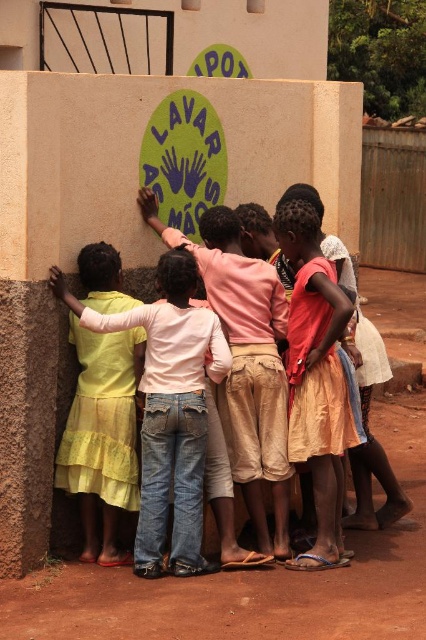
Is light yellow denim jeans at left to the left of light orange skirt at center from the viewer's perspective?

Indeed, light yellow denim jeans at left is positioned on the left side of light orange skirt at center.

Between point (204, 412) and point (285, 364), which one is positioned behind?

The point (285, 364) is more distant.

At what (x,y) coordinates should I click in order to perform the action: click on light yellow denim jeans at left. Please return your answer as a coordinate pair (x, y). The image size is (426, 640). Looking at the image, I should click on (169, 410).

Find the location of `light yellow denim jeans at left`. light yellow denim jeans at left is located at coordinates (169, 410).

Can you confirm if pink cotton shirt at center is taller than light orange skirt at center?

Correct, pink cotton shirt at center is much taller as light orange skirt at center.

Does point (282, 404) come behind point (290, 234)?

Yes, it is behind point (290, 234).

Find the location of a particular element. The height and width of the screenshot is (640, 426). pink cotton shirt at center is located at coordinates (244, 360).

Who is lower down, light yellow denim jeans at left or pink cotton shirt at center?

light yellow denim jeans at left is below.

Which is more to the left, light yellow denim jeans at left or pink cotton shirt at center?

Positioned to the left is light yellow denim jeans at left.

Between point (164, 512) and point (238, 308), which one is positioned behind?

The point (238, 308) is more distant.

Identify the location of light yellow denim jeans at left. Image resolution: width=426 pixels, height=640 pixels. (169, 410).